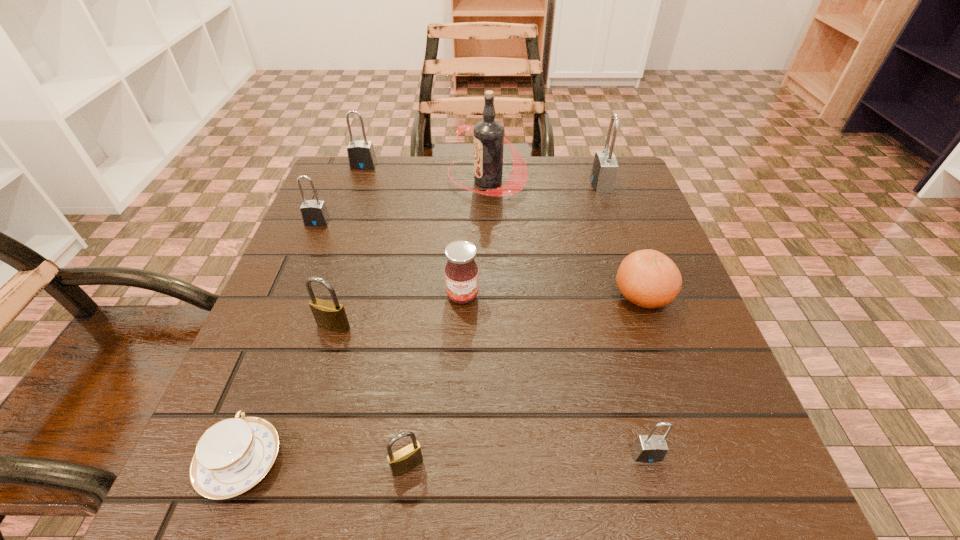
Identify the location of vacant area that lies between the root beer and the clementine. (564, 238).

In order to click on free space that is in between the fourth nearest padlock and the left brass padlock in this screenshot , I will do `click(325, 274)`.

You are a GUI agent. You are given a task and a screenshot of the screen. Output one action in this format:
    pyautogui.click(x=<x>, y=<y>)
    Task: Click on the free space between the second smallest gray padlock and the blue teacup
    The height and width of the screenshot is (540, 960).
    Given the screenshot: What is the action you would take?
    pyautogui.click(x=279, y=342)

You are a GUI agent. You are given a task and a screenshot of the screen. Output one action in this format:
    pyautogui.click(x=<x>, y=<y>)
    Task: Click on the empty space between the second gray padlock from right to left and the blue teacup
    The width and height of the screenshot is (960, 540).
    Given the screenshot: What is the action you would take?
    pyautogui.click(x=444, y=458)

In order to click on free space that is in between the seventh farthest object and the third biggest gray padlock in this screenshot , I will do `click(325, 274)`.

What are the coordinates of `vacant area that lies between the farther brass padlock and the smallest gray padlock` in the screenshot? It's located at (491, 390).

Point out which object is positioned as the fifth nearest to the farther brass padlock. Please provide its 2D coordinates. Your answer should be formatted as a tuple, i.e. [(x, y)], where the tuple contains the x and y coordinates of a point satisfying the conditions above.

[(488, 134)]

Identify which object is the third closest to the clementine. Please provide its 2D coordinates. Your answer should be formatted as a tuple, i.e. [(x, y)], where the tuple contains the x and y coordinates of a point satisfying the conditions above.

[(488, 134)]

Locate an element on the screen. This screenshot has width=960, height=540. padlock that can be found as the fifth closest to the second farthest gray padlock is located at coordinates (406, 458).

Identify which padlock is located as the third nearest to the tallest object. Please provide its 2D coordinates. Your answer should be formatted as a tuple, i.e. [(x, y)], where the tuple contains the x and y coordinates of a point satisfying the conditions above.

[(314, 213)]